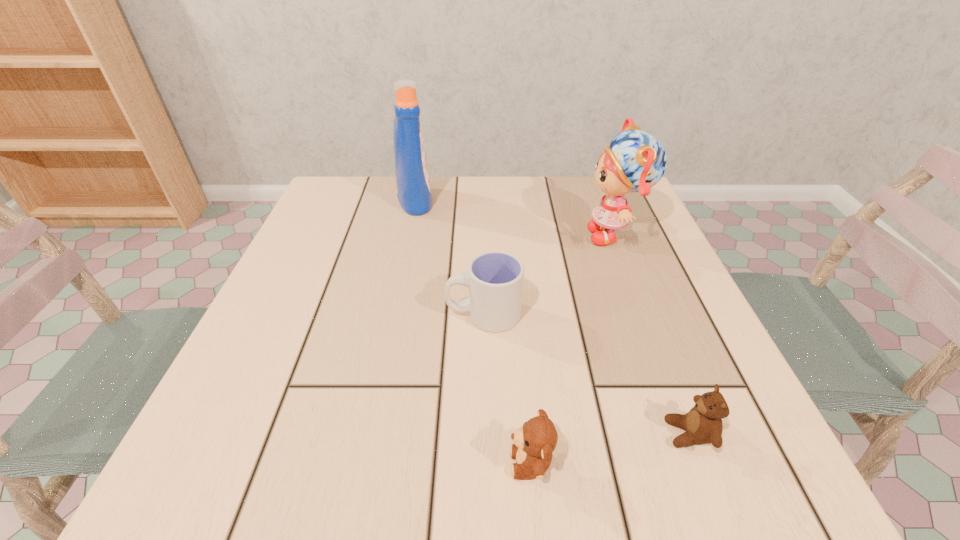
This screenshot has height=540, width=960. I want to click on free area in between the left teddy bear and the fourth shortest object, so click(572, 349).

Where is `the third closest object to the right teddy bear`? This screenshot has width=960, height=540. the third closest object to the right teddy bear is located at coordinates pyautogui.click(x=635, y=161).

Identify which object is the third nearest to the cup. Please provide its 2D coordinates. Your answer should be formatted as a tuple, i.e. [(x, y)], where the tuple contains the x and y coordinates of a point satisfying the conditions above.

[(703, 424)]